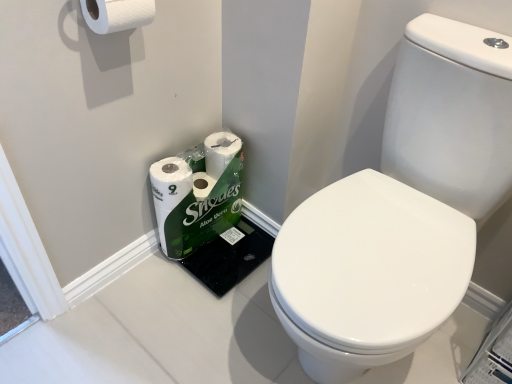
Question: From their relative heights in the image, would you say white glossy toilet at center is taller or shorter than white glossy toilet paper at lower left, the first toilet paper from the back?

Choices:
 (A) tall
 (B) short

Answer: (A)

Question: Which is correct: white glossy toilet at center is inside white glossy toilet paper at lower left, the second toilet paper in the front-to-back sequence, or outside of it?

Choices:
 (A) outside
 (B) inside

Answer: (A)

Question: Based on their relative distances, which object is farther from the white glossy toilet at center?

Choices:
 (A) white matte toilet paper at upper left, the second toilet paper when ordered from bottom to top
 (B) white glossy toilet paper at lower left, acting as the first toilet paper starting from the bottom

Answer: (A)

Question: Which is nearer to the white glossy toilet paper at lower left, acting as the first toilet paper starting from the bottom?

Choices:
 (A) white glossy toilet at center
 (B) white matte toilet paper at upper left, the first toilet paper from the front

Answer: (A)